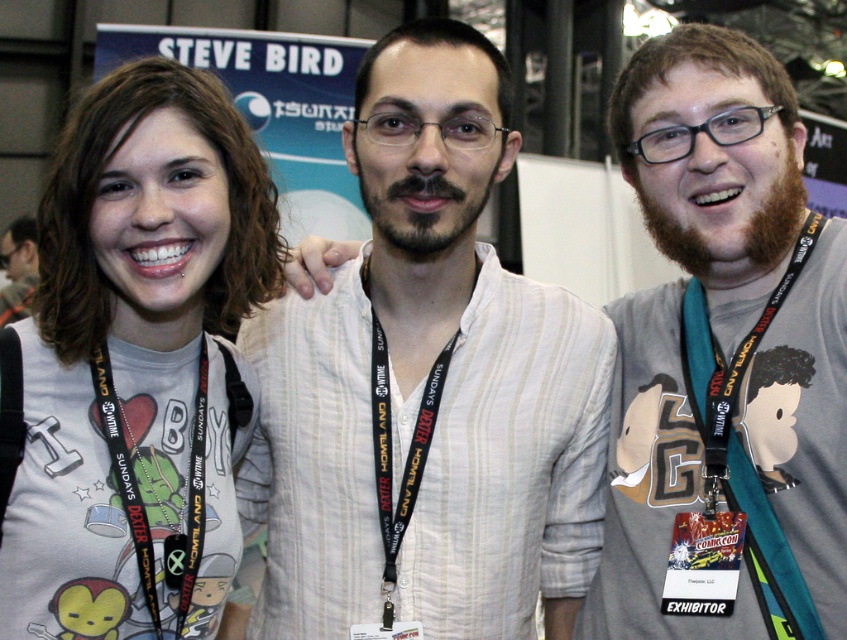
You are a photographer at the event and need to ensure that the white striped shirt at center and the teal fabric lanyard at center are both visible in the photo. Given that the shirt is larger, which object should you focus on to ensure both are in frame?

Since the white striped shirt at center is bigger than the teal fabric lanyard at center, you should focus on the white striped shirt at center to ensure both are in frame as it takes up more space.

You are a photographer at the event and need to adjust the lighting to ensure the white matte t shirt at center is well lit. Given that the light source is currently positioned at point (137,364), which is where the white matte t shirt at center is located, is the light source directly over the white matte t shirt at center?

Yes, the light source is directly over the white matte t shirt at center because the point (137,364) corresponds to its location.

You are at a comic book expo and want to find the person wearing the white striped shirt at center. According to the provided scene description, where should you look relative to the other attendees?

The white striped shirt at center is located at point 0.603 on the horizontal axis and 0.505 on the vertical axis, so you should look towards the middle of the image slightly to the right.